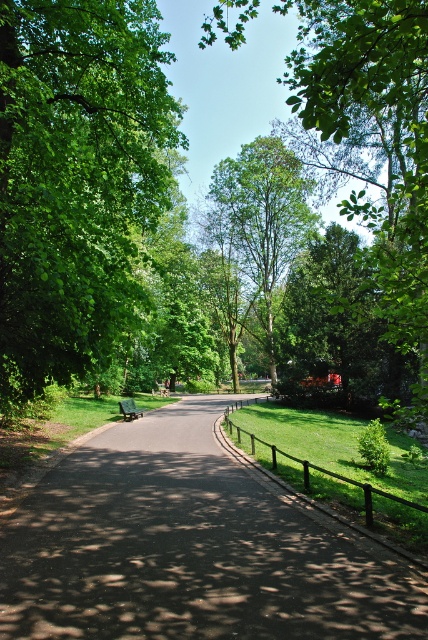
You are planning to place a picnic blanket in the park. The picnic blanket is 2 meters wide. You want to place it under the green leafy tree at left and the green leafy tree at center. Which tree has a canopy wide enough to cover the entire picnic blanket?

The green leafy tree at center has a wider canopy than the green leafy tree at left, so it can cover the entire 2 meter wide picnic blanket.

You are a park visitor carrying a picnic basket and want to sit under the shade of the green leafy tree at left while placing your basket on the green wooden bench at center. Can you do this without walking more than 15 meters?

The distance between the green leafy tree at left and the green wooden bench at center is 13.09 meters. Since this distance is less than 15 meters, you can walk from the green leafy tree at left to the green wooden bench at center and place your basket there without exceeding the 15 meter limit.

You are standing at the edge of the park pathway and want to reach the green leafy tree at center. If your walking speed is 1.5 meters per second, how many seconds will it take you to reach the tree?

The distance between you and the green leafy tree at center is 40.83 meters. At a walking speed of 1.5 meters per second, it will take approximately 27.22 seconds to reach the tree.